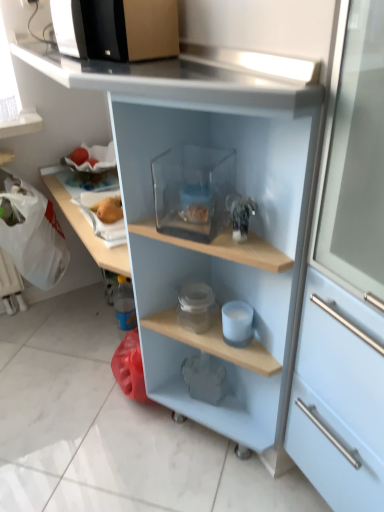
Question: Considering the relative positions of yellow matte apple at upper left and transparent plastic container at center in the image provided, is yellow matte apple at upper left to the right of transparent plastic container at center from the viewer's perspective?

Choices:
 (A) no
 (B) yes

Answer: (A)

Question: Does yellow matte apple at upper left come behind transparent plastic container at center?

Choices:
 (A) yes
 (B) no

Answer: (A)

Question: Can you confirm if yellow matte apple at upper left is smaller than transparent plastic container at center?

Choices:
 (A) no
 (B) yes

Answer: (B)

Question: Is yellow matte apple at upper left taller than transparent plastic container at center?

Choices:
 (A) yes
 (B) no

Answer: (B)

Question: From the image's perspective, is yellow matte apple at upper left on top of transparent plastic container at center?

Choices:
 (A) yes
 (B) no

Answer: (A)

Question: Relative to yellow matte apple at upper left, is transparent plastic container at center in front or behind?

Choices:
 (A) front
 (B) behind

Answer: (A)

Question: From a real-world perspective, is transparent plastic container at center positioned above or below yellow matte apple at upper left?

Choices:
 (A) above
 (B) below

Answer: (B)

Question: Is transparent plastic container at center wider or thinner than yellow matte apple at upper left?

Choices:
 (A) wide
 (B) thin

Answer: (A)

Question: Is transparent plastic container at center inside the boundaries of yellow matte apple at upper left, or outside?

Choices:
 (A) inside
 (B) outside

Answer: (B)

Question: Looking at their shapes, would you say white matte cup at center, the second appliance viewed from the back, is wider or thinner than transparent glass container at center, the third appliance in the back-to-front sequence?

Choices:
 (A) thin
 (B) wide

Answer: (A)

Question: Is white matte cup at center, arranged as the second appliance when viewed from the top, situated inside transparent glass container at center, arranged as the first appliance when viewed from the top, or outside?

Choices:
 (A) outside
 (B) inside

Answer: (A)

Question: From a real-world perspective, is white matte cup at center, which is the second appliance in front-to-back order, above or below transparent glass container at center, arranged as the first appliance when viewed from the top?

Choices:
 (A) above
 (B) below

Answer: (B)

Question: Is point (243, 305) positioned closer to the camera than point (185, 196)?

Choices:
 (A) farther
 (B) closer

Answer: (A)

Question: From a real-world perspective, is transparent glass container at center, marked as the 1th appliance in a front-to-back arrangement, physically located above or below black plastic microwave at upper left?

Choices:
 (A) below
 (B) above

Answer: (A)

Question: Is transparent glass container at center, the 3th appliance when ordered from bottom to top, spatially inside black plastic microwave at upper left, or outside of it?

Choices:
 (A) inside
 (B) outside

Answer: (B)